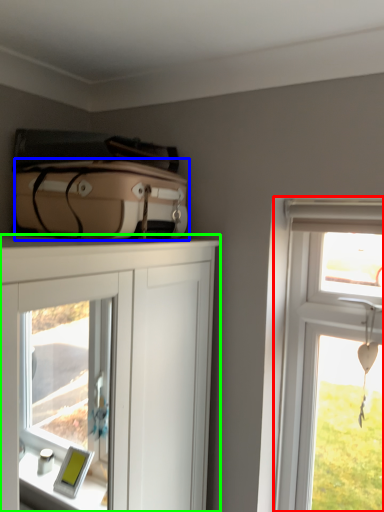
Question: Which object is the farthest from window (highlighted by a red box)? Choose among these: suitcase (highlighted by a blue box) or cabinetry (highlighted by a green box).

Choices:
 (A) suitcase
 (B) cabinetry

Answer: (B)